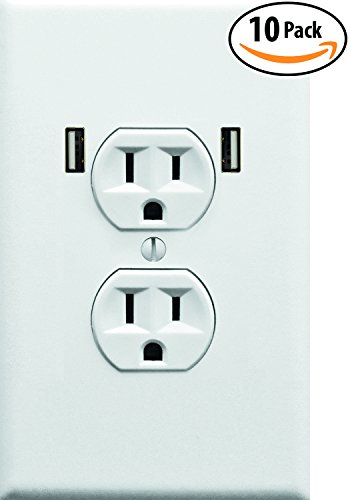
The width and height of the screenshot is (350, 500). I want to click on usb charger, so click(75, 141), click(230, 144).